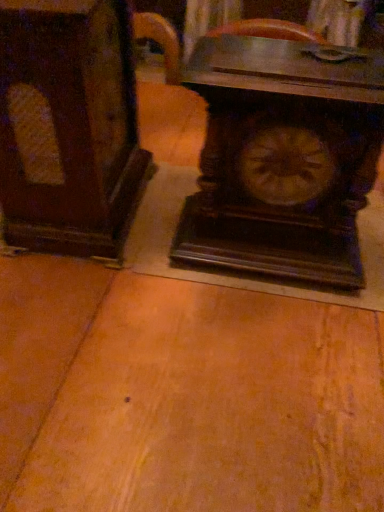
Locate an element on the screen. This screenshot has height=512, width=384. vacant point to the right of dark wood cabinet at left is located at coordinates (178, 218).